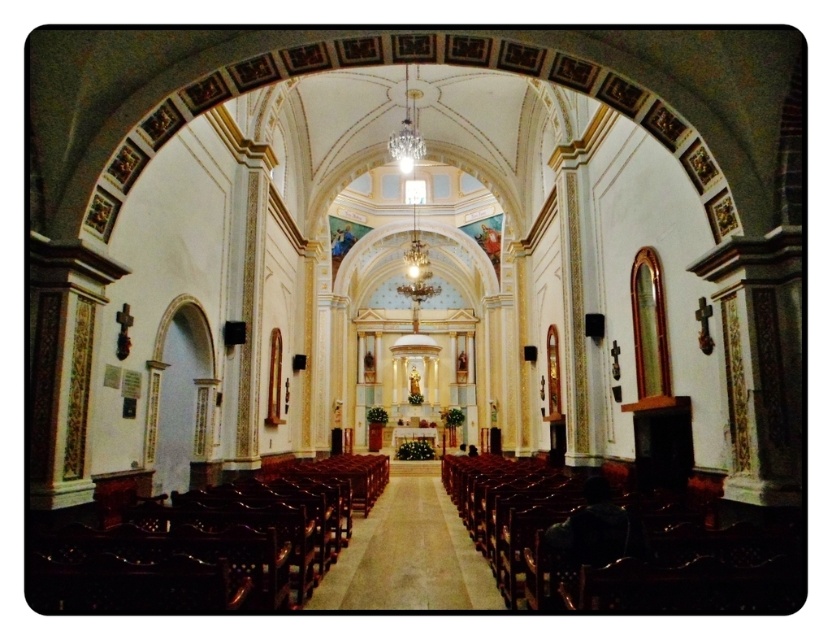
You are standing at the entrance of the grand church and want to find the polished dark wood chairs at left. According to the coordinate system where the bottom left corner is the origin, the chairs are located at point (208, 541). Can you estimate their position relative to the entrance?

The polished dark wood chairs at left are located at point (208, 541) in the coordinate system, which means they are positioned near the right side and upper part of the image from the entrance perspective.

You are an interior designer planning to place a new sculpture in this church. The sculpture requires a space larger than the mahogany polished wood chair at lower right. Based on the scene description, is the wooden polished aisle at center suitable for placing the sculpture? Please explain your reasoning.

The mahogany polished wood chair at lower right has a larger size compared to the wooden polished aisle at center. Since the sculpture requires a space larger than the mahogany polished wood chair at lower right, the wooden polished aisle at center is not suitable because it is smaller in size.

You are standing in the nave of the church and want to walk towards the altar. You see the mahogany polished wood chair at lower right and the wooden polished aisle at center. Which direction should you walk to reach the altar without passing near the chair?

You should walk along the wooden polished aisle at center on the left side of the mahogany polished wood chair at lower right to avoid passing near the chair while heading towards the altar.